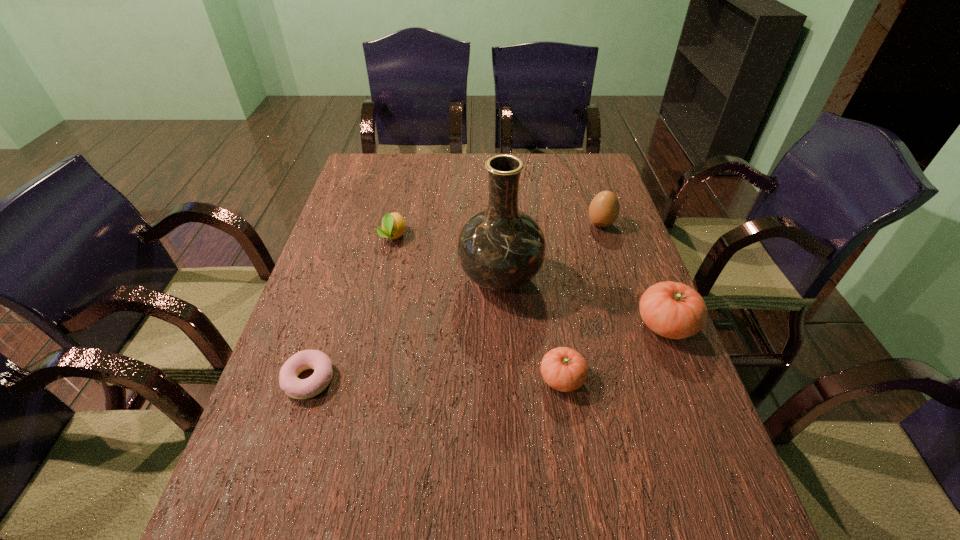
Please point a vacant point for placing a tomato on the left. Please provide its 2D coordinates. Your answer should be formatted as a tuple, i.e. [(x, y)], where the tuple contains the x and y coordinates of a point satisfying the conditions above.

[(431, 447)]